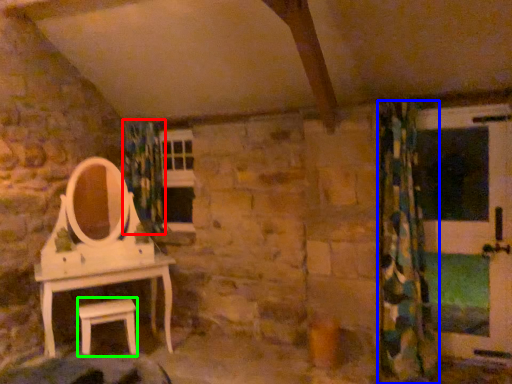
Question: Estimate the real-world distances between objects in this image. Which object is farther from shower curtain (highlighted by a red box), curtain (highlighted by a blue box) or furniture (highlighted by a green box)?

Choices:
 (A) curtain
 (B) furniture

Answer: (A)